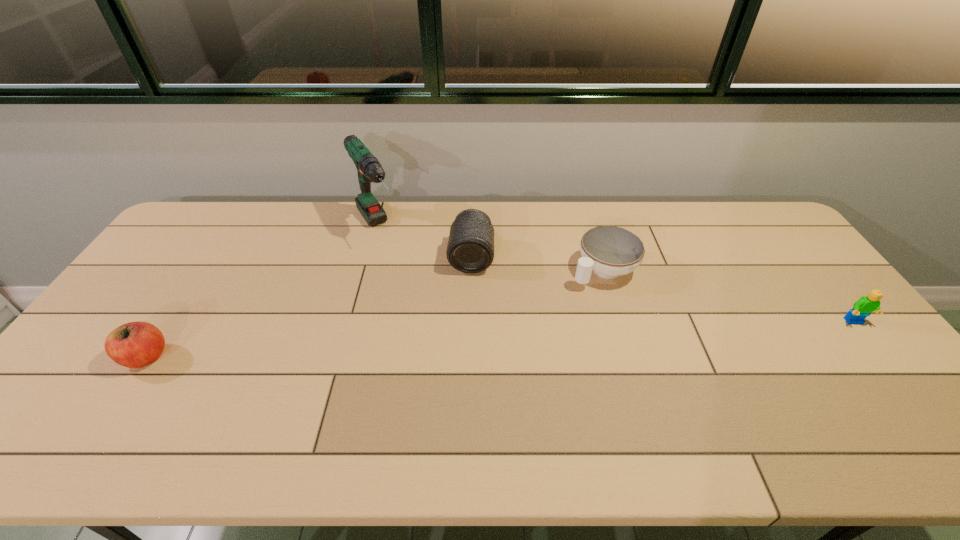
At what (x,y) coordinates should I click in order to perform the action: click on telephoto lens at the far edge. Please return your answer as a coordinate pair (x, y). Looking at the image, I should click on (470, 249).

Find the location of a particular element. The image size is (960, 540). drill that is at the far edge is located at coordinates (369, 169).

Where is `object that is at the left edge`? object that is at the left edge is located at coordinates (137, 344).

This screenshot has height=540, width=960. In order to click on object that is at the right edge in this screenshot , I will do (865, 305).

Identify the location of free space at the far edge of the desktop. (362, 220).

Locate an element on the screen. This screenshot has width=960, height=540. free space at the near edge of the desktop is located at coordinates (195, 384).

Locate an element on the screen. blank space at the left edge is located at coordinates (141, 320).

Image resolution: width=960 pixels, height=540 pixels. In order to click on vacant space at the right edge of the desktop in this screenshot , I will do `click(826, 295)`.

Locate an element on the screen. This screenshot has height=540, width=960. free space at the far left corner of the desktop is located at coordinates (219, 219).

This screenshot has width=960, height=540. In the image, there is a desktop. Find the location of `free space at the far right corner`. free space at the far right corner is located at coordinates (744, 218).